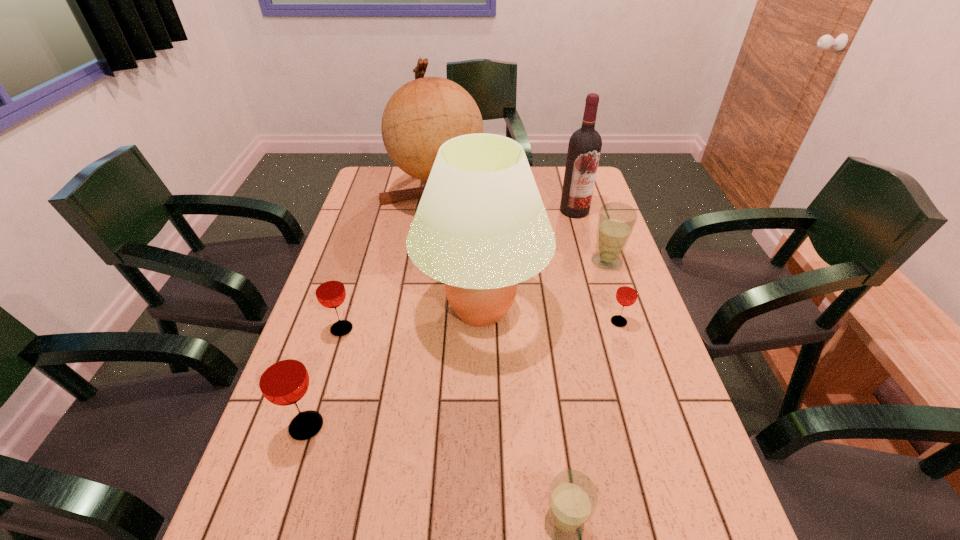
Point out which glass is positioned as the fifth nearest to the beige lampshade. Please provide its 2D coordinates. Your answer should be formatted as a tuple, i.e. [(x, y)], where the tuple contains the x and y coordinates of a point satisfying the conditions above.

[(573, 498)]

In order to click on red glass that is the closest one to the second smallest red glass in this screenshot , I will do `click(282, 377)`.

Identify which red glass is the second nearest to the globe. Please provide its 2D coordinates. Your answer should be formatted as a tuple, i.e. [(x, y)], where the tuple contains the x and y coordinates of a point satisfying the conditions above.

[(627, 292)]

Where is `free location that satisfies the following two spatial constraints: 1. on the surface of the globe; 2. on the left side of the farthest glass`? This screenshot has width=960, height=540. free location that satisfies the following two spatial constraints: 1. on the surface of the globe; 2. on the left side of the farthest glass is located at coordinates (426, 261).